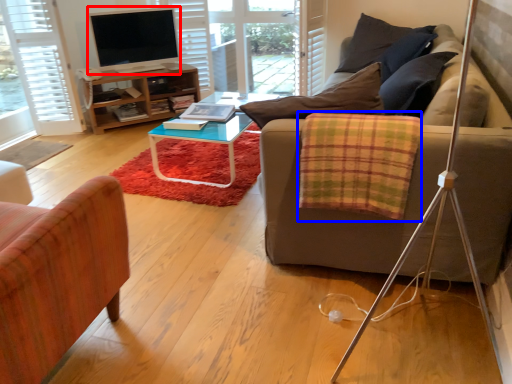
Question: Which object is closer to the camera taking this photo, television (highlighted by a red box) or blanket (highlighted by a blue box)?

Choices:
 (A) television
 (B) blanket

Answer: (B)